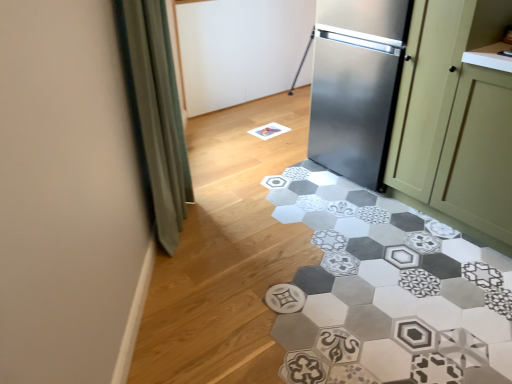
Question: Is gray hexagonal tile at center in front of or behind green matte cabinet at right in the image?

Choices:
 (A) behind
 (B) front

Answer: (B)

Question: Based on their sizes in the image, would you say gray hexagonal tile at center is bigger or smaller than green matte cabinet at right?

Choices:
 (A) big
 (B) small

Answer: (B)

Question: Which is farther from the green fabric curtain at left?

Choices:
 (A) stainless steel cabinet at right
 (B) gray hexagonal tile at center
 (C) green matte cabinet at right

Answer: (C)

Question: Based on their relative distances, which object is farther from the green matte cabinet at right?

Choices:
 (A) green fabric curtain at left
 (B) gray hexagonal tile at center
 (C) stainless steel cabinet at right

Answer: (A)